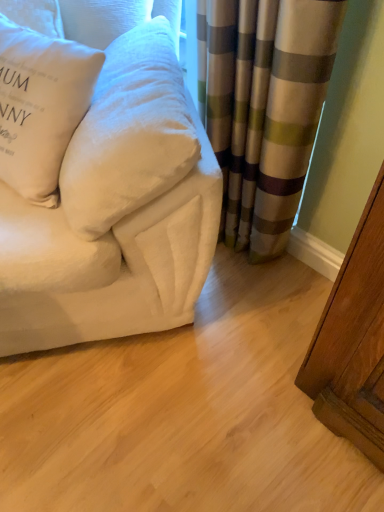
I want to click on blank area beneath striped fabric curtain at center (from a real-world perspective), so click(245, 261).